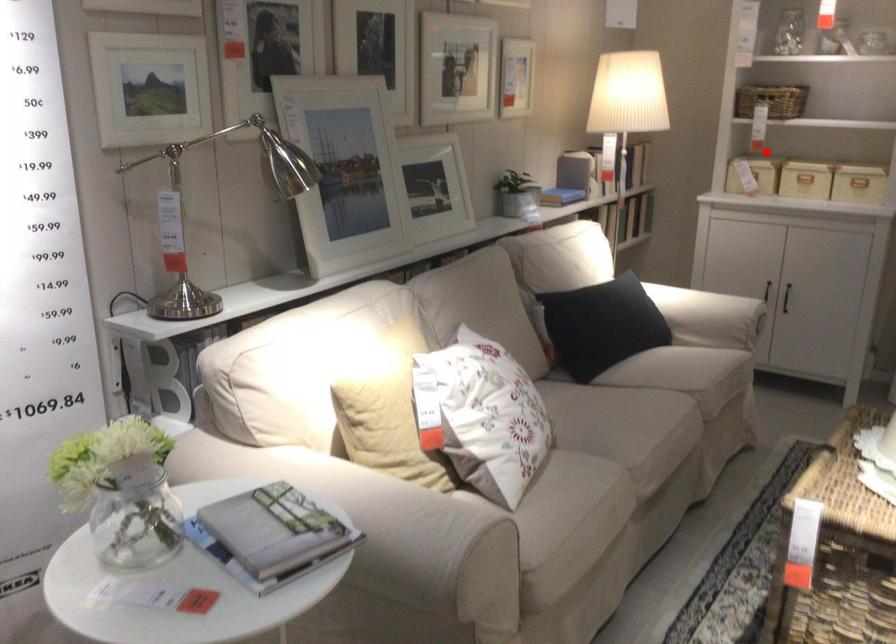
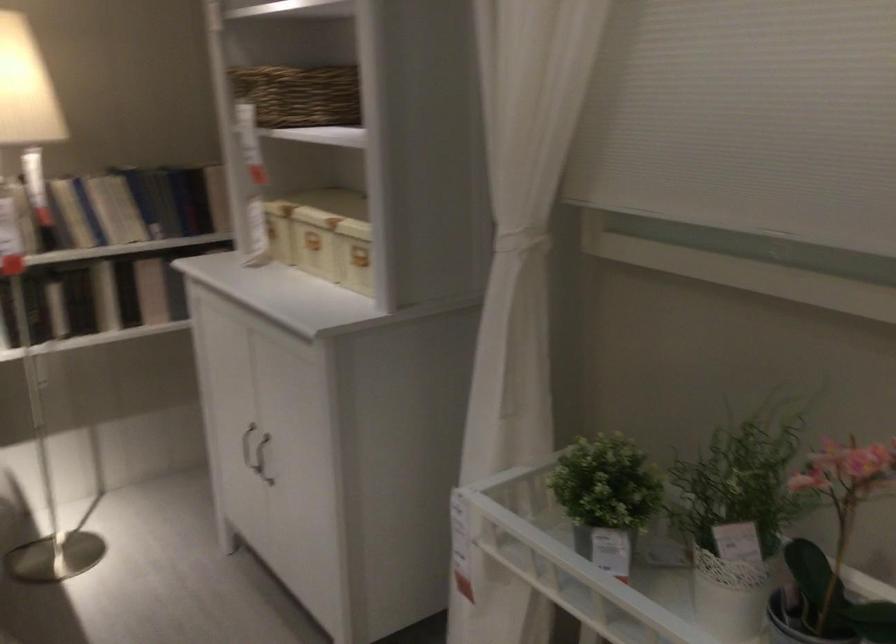
Question: I am providing you with two images of the same scene from different viewpoints. Given a red point in image1, look at the same physical point in image2. Is it:

Choices:
 (A) Closer to the viewpoint
 (B) Farther from the viewpoint

Answer: (A)